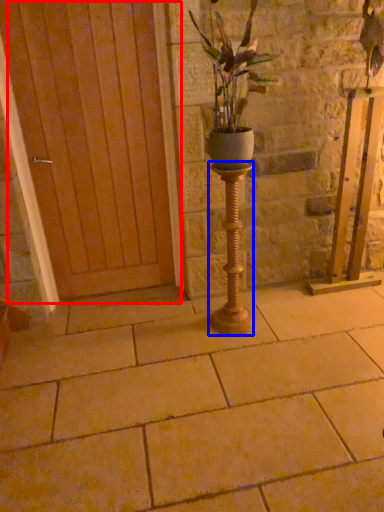
Question: Among these objects, which one is farthest to the camera, door (highlighted by a red box) or candle holder (highlighted by a blue box)?

Choices:
 (A) door
 (B) candle holder

Answer: (A)